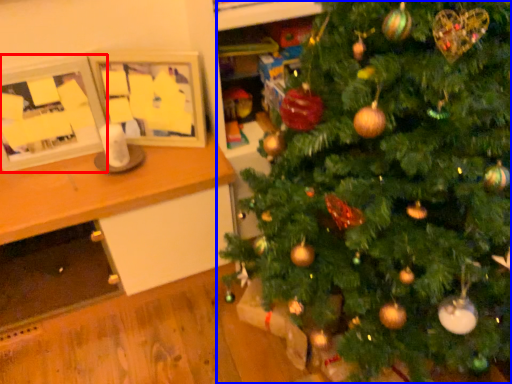
Question: Which object appears closest to the camera in this image, picture frame (highlighted by a red box) or christmas tree (highlighted by a blue box)?

Choices:
 (A) picture frame
 (B) christmas tree

Answer: (B)